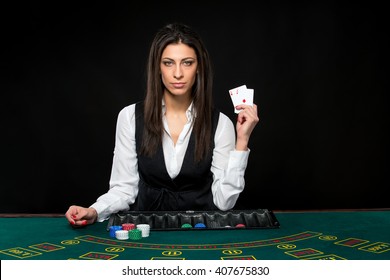
Where is `black wall`? The height and width of the screenshot is (280, 390). black wall is located at coordinates (302, 78).